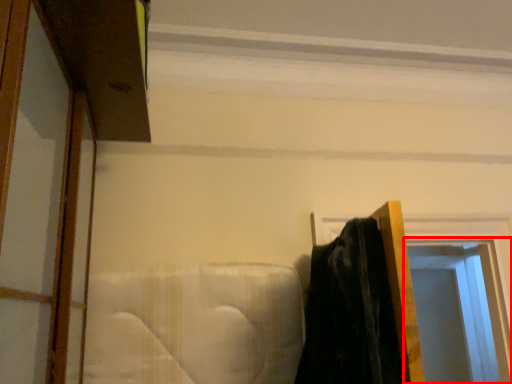
Question: From the image's perspective, where is window (annotated by the red box) located in relation to window frame in the image?

Choices:
 (A) below
 (B) above

Answer: (A)